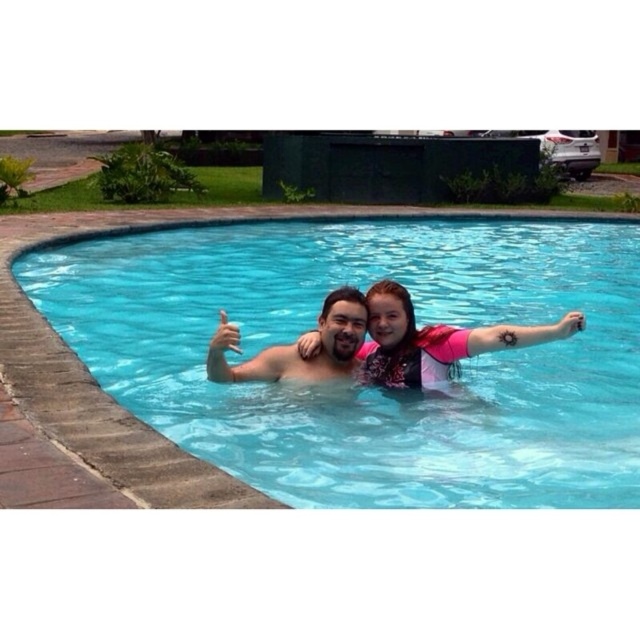
Question: Can you confirm if clear blue water at center is positioned below pink neoprene swimsuit at center?

Choices:
 (A) no
 (B) yes

Answer: (A)

Question: Does clear blue water at center have a smaller size compared to pink neoprene swimsuit at center?

Choices:
 (A) yes
 (B) no

Answer: (B)

Question: Which object is farther from the camera taking this photo?

Choices:
 (A) pink neoprene swimsuit at center
 (B) clear blue water at center

Answer: (A)

Question: Can you confirm if clear blue water at center is positioned below pink neoprene swimsuit at center?

Choices:
 (A) no
 (B) yes

Answer: (A)

Question: Among these objects, which one is nearest to the camera?

Choices:
 (A) pink neoprene swimsuit at center
 (B) clear blue water at center

Answer: (B)